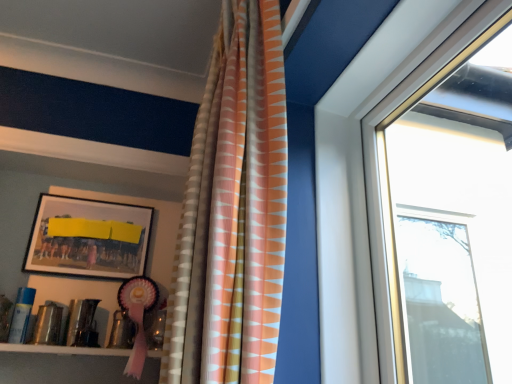
Question: Should I look upward or downward to see matte black picture frame at upper left?

Choices:
 (A) down
 (B) up

Answer: (A)

Question: Considering the relative sizes of matte black picture frame at upper left and textured orange and white curtain at center in the image provided, is matte black picture frame at upper left smaller than textured orange and white curtain at center?

Choices:
 (A) yes
 (B) no

Answer: (A)

Question: Is there a large distance between matte black picture frame at upper left and textured orange and white curtain at center?

Choices:
 (A) no
 (B) yes

Answer: (A)

Question: Is matte black picture frame at upper left placed right next to textured orange and white curtain at center?

Choices:
 (A) no
 (B) yes

Answer: (A)

Question: Considering the relative positions of matte black picture frame at upper left and textured orange and white curtain at center in the image provided, is matte black picture frame at upper left to the left of textured orange and white curtain at center from the viewer's perspective?

Choices:
 (A) no
 (B) yes

Answer: (B)

Question: From a real-world perspective, does matte black picture frame at upper left stand above textured orange and white curtain at center?

Choices:
 (A) yes
 (B) no

Answer: (A)

Question: Is matte black picture frame at upper left at the right side of textured orange and white curtain at center?

Choices:
 (A) no
 (B) yes

Answer: (A)

Question: Considering the relative sizes of textured orange and white curtain at center and matte black picture frame at upper left in the image provided, is textured orange and white curtain at center wider than matte black picture frame at upper left?

Choices:
 (A) yes
 (B) no

Answer: (A)

Question: Does textured orange and white curtain at center contain matte black picture frame at upper left?

Choices:
 (A) no
 (B) yes

Answer: (A)

Question: Can you confirm if textured orange and white curtain at center is positioned to the left of matte black picture frame at upper left?

Choices:
 (A) no
 (B) yes

Answer: (A)

Question: Does textured orange and white curtain at center have a lesser height compared to matte black picture frame at upper left?

Choices:
 (A) no
 (B) yes

Answer: (A)

Question: From the image's perspective, is textured orange and white curtain at center over matte black picture frame at upper left?

Choices:
 (A) no
 (B) yes

Answer: (B)

Question: Is textured orange and white curtain at center to the right of matte black picture frame at upper left from the viewer's perspective?

Choices:
 (A) no
 (B) yes

Answer: (B)

Question: From a real-world perspective, is textured orange and white curtain at center above or below matte black picture frame at upper left?

Choices:
 (A) below
 (B) above

Answer: (A)